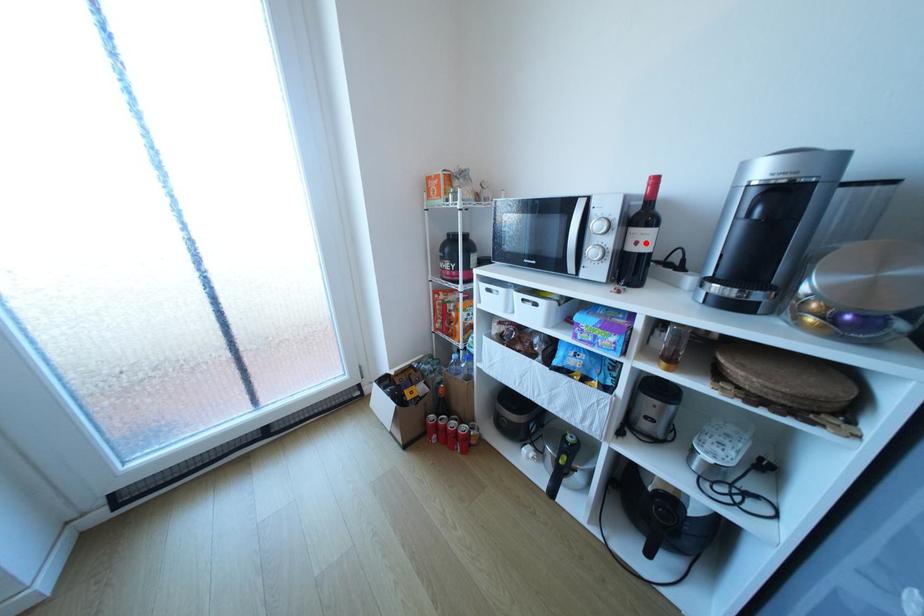
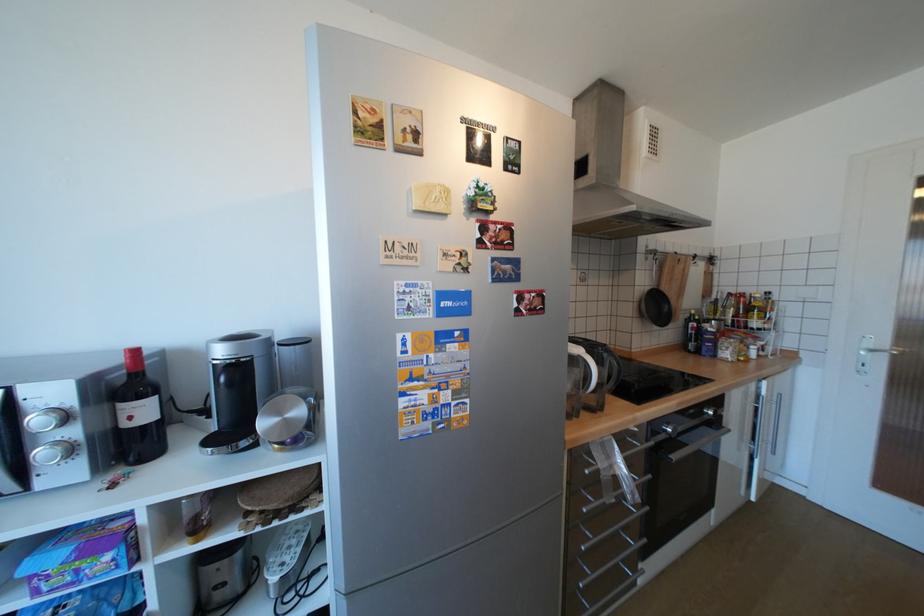
Locate, in the second image, the point that corresponds to the highlighted location in the first image.

(140, 418)